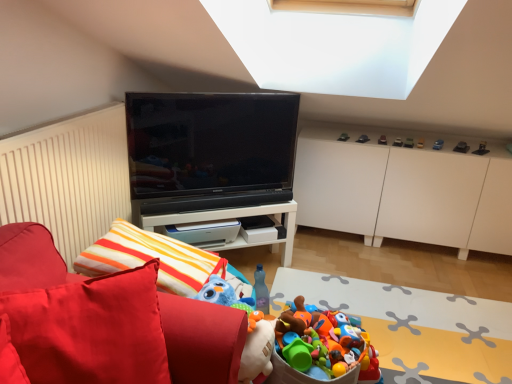
Where is `vacant space in front of metallic gray toy car at upper right, the 2th toy viewed from the right`? This screenshot has width=512, height=384. vacant space in front of metallic gray toy car at upper right, the 2th toy viewed from the right is located at coordinates (472, 151).